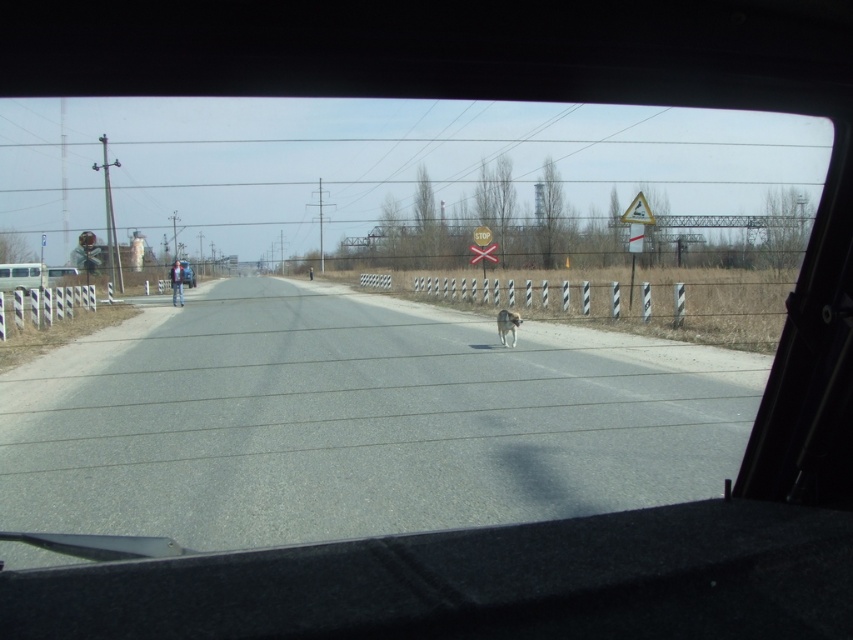
Looking at this image, you are driving a car and want to know if the white matte van at left is fully visible through the transparent glass windshield at center. Based on their heights, can you determine if the van is entirely visible through the windshield?

The transparent glass windshield at center is much taller than the white matte van at left, so the van is entirely visible through the windshield.

You are driving a car and see the white matte van at left and the white fur dog at center on the road. Which one is closer to the left side of the road?

The white matte van at left is positioned on the left side of the white fur dog at center, so the white matte van at left is closer to the left side of the road.